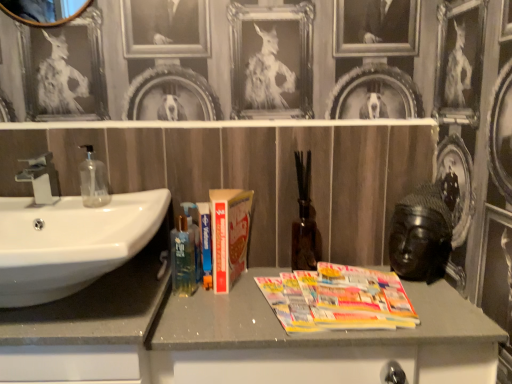
This screenshot has height=384, width=512. I want to click on vacant space that is in between hardcover book at center and multicolored glossy magazines at center, so click(x=255, y=299).